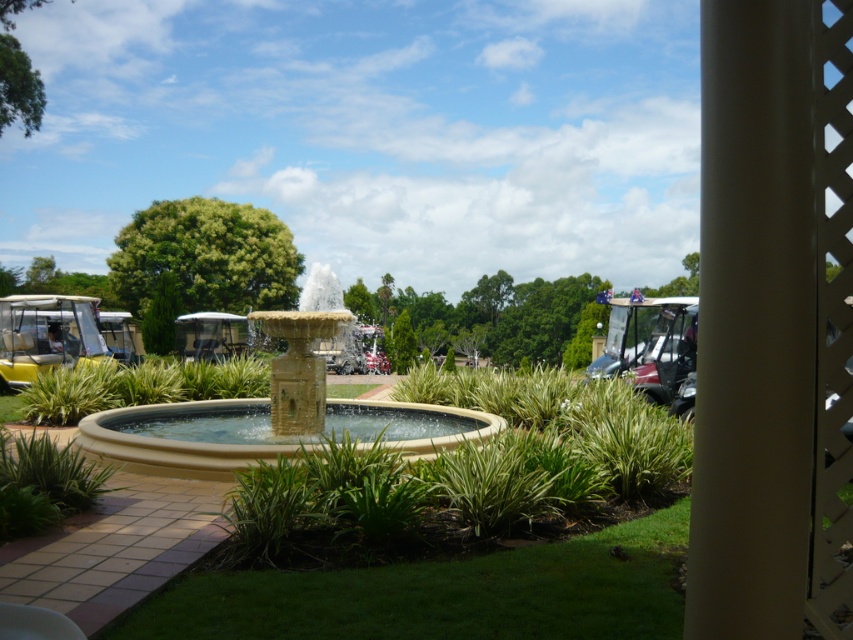
Question: Among these points, which one is nearest to the camera?

Choices:
 (A) click(x=669, y=380)
 (B) click(x=82, y=320)

Answer: (A)

Question: Which point appears closest to the camera in this image?

Choices:
 (A) (65, 301)
 (B) (312, 275)
 (C) (730, 243)

Answer: (C)

Question: Which object is closer to the camera taking this photo?

Choices:
 (A) black plastic golf cart at right
 (B) beige stone fountain at center
 (C) white textured pillar at center right

Answer: (C)

Question: In this image, where is yellow matte golf cart at left located relative to black plastic golf cart at right?

Choices:
 (A) left
 (B) right

Answer: (A)

Question: Is white textured pillar at center right positioned in front of beige stone fountain at center?

Choices:
 (A) no
 (B) yes

Answer: (B)

Question: Is beige stone fountain at center thinner than yellow matte golf cart at left?

Choices:
 (A) yes
 (B) no

Answer: (A)